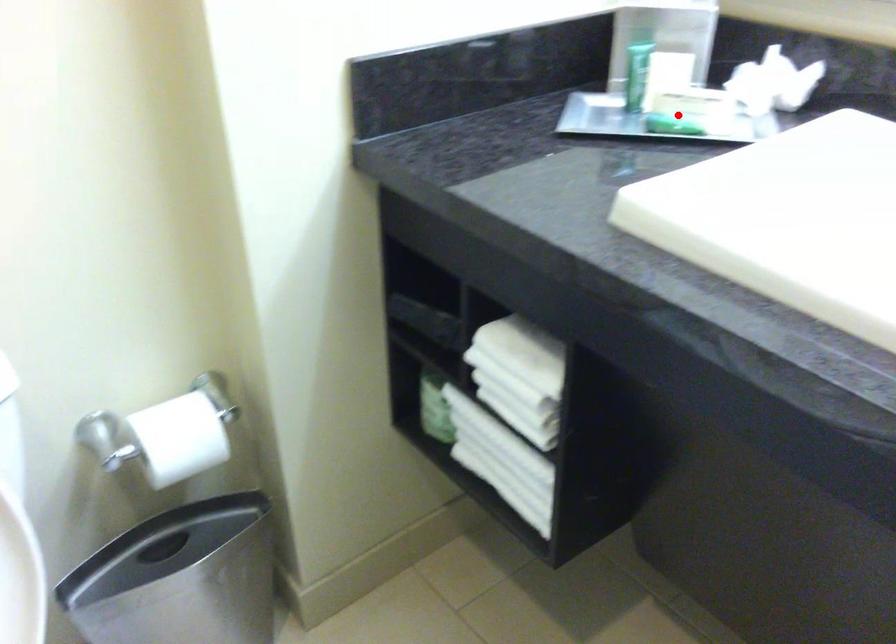
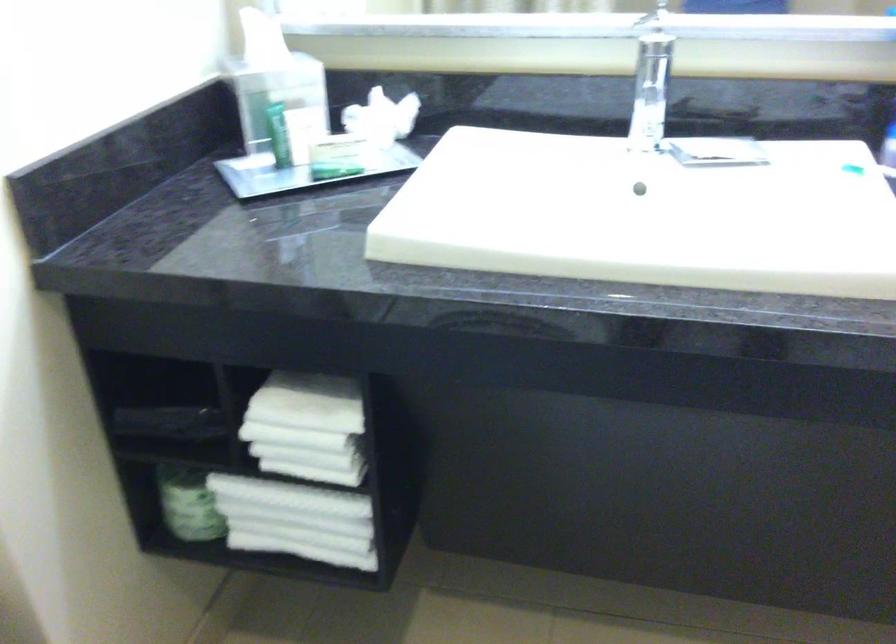
Question: I am providing you with two images of the same scene from different viewpoints. A red point is shown in image1. For the corresponding object point in image2, is it positioned nearer or farther from the camera?

Choices:
 (A) Nearer
 (B) Farther

Answer: (B)